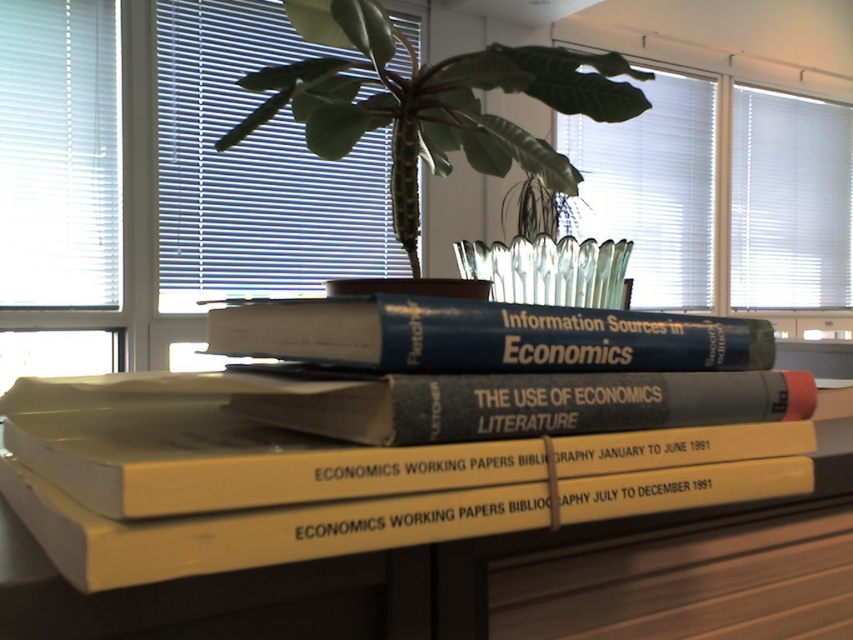
You are organizing a study area and need to place a new book on the desk. The desk has limited space between the transparent glass window at upper center and the blue hardcover book at center. Can you fit a book that is 10 cm thick between them?

The transparent glass window at upper center is above the blue hardcover book at center, so there is vertical space between them. However, since the desk surface is horizontal, the vertical gap might not allow placing a book horizontally. You may need to check the horizontal space available on the desk instead.